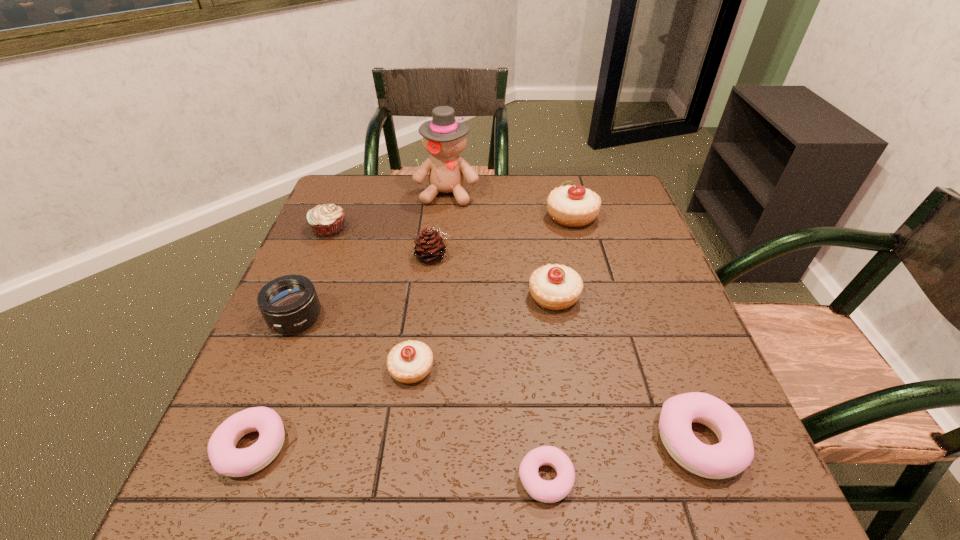
Image resolution: width=960 pixels, height=540 pixels. Find the location of `vacant area between the telephoto lens and the fourth nearest object`. vacant area between the telephoto lens and the fourth nearest object is located at coordinates (353, 343).

Where is `free spot between the fourth nearest pastry and the muffin`? Image resolution: width=960 pixels, height=540 pixels. free spot between the fourth nearest pastry and the muffin is located at coordinates click(x=371, y=299).

At what (x,y) coordinates should I click in order to perform the action: click on empty space between the rag_doll and the telephoto lens. Please return your answer as a coordinate pair (x, y). This screenshot has height=540, width=960. Looking at the image, I should click on (372, 255).

The height and width of the screenshot is (540, 960). I want to click on the fifth closest object relative to the muffin, so click(555, 287).

At what (x,y) coordinates should I click in order to perform the action: click on object that is the second nearest to the second nearest beige pastry. Please return your answer as a coordinate pair (x, y). The height and width of the screenshot is (540, 960). Looking at the image, I should click on (573, 206).

You are a GUI agent. You are given a task and a screenshot of the screen. Output one action in this format:
    pyautogui.click(x=<x>, y=<y>)
    Task: Click on the pastry that is the third closest to the fourth farthest object
    The image size is (960, 540).
    Given the screenshot: What is the action you would take?
    pyautogui.click(x=573, y=206)

This screenshot has height=540, width=960. I want to click on pastry that is the closest to the muffin, so (411, 361).

Identify which beige pastry is the third nearest to the brown pinecone. Please provide its 2D coordinates. Your answer should be formatted as a tuple, i.e. [(x, y)], where the tuple contains the x and y coordinates of a point satisfying the conditions above.

[(573, 206)]

Point out which beige pastry is positioned as the nearest to the second farthest beige pastry. Please provide its 2D coordinates. Your answer should be formatted as a tuple, i.e. [(x, y)], where the tuple contains the x and y coordinates of a point satisfying the conditions above.

[(573, 206)]

I want to click on pink pastry that is the third closest one to the telephoto lens, so pos(734,453).